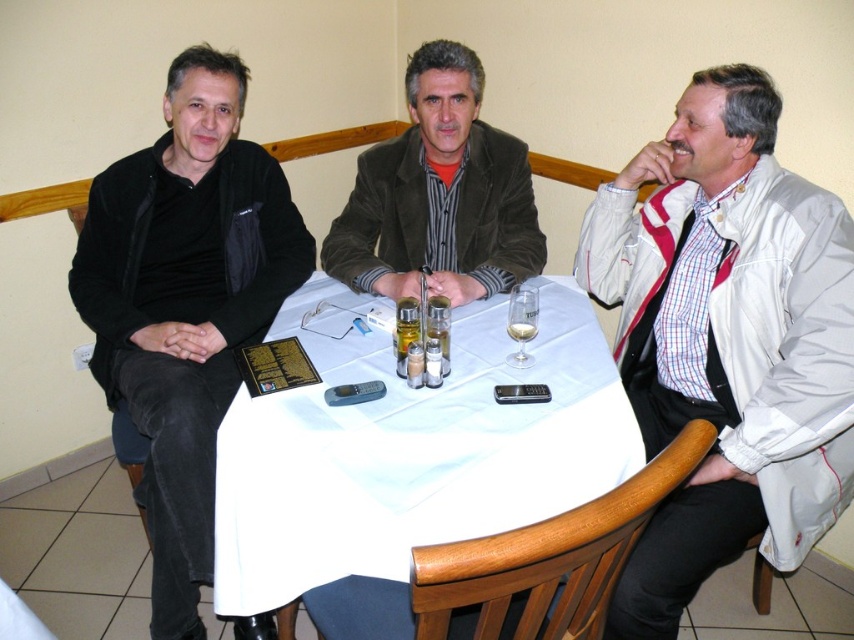
Is point (613, 221) in front of point (399, 161)?

Yes.

What do you see at coordinates (726, 340) in the screenshot? This screenshot has width=854, height=640. I see `white leather jacket at right` at bounding box center [726, 340].

Between point (658, 636) and point (334, 264), which one is positioned in front?

Positioned in front is point (658, 636).

Locate an element on the screen. Image resolution: width=854 pixels, height=640 pixels. white leather jacket at right is located at coordinates (726, 340).

Between white leather jacket at right and black matte jacket at left, which one has more height?

black matte jacket at left

Does white leather jacket at right appear under black matte jacket at left?

Correct, white leather jacket at right is located below black matte jacket at left.

Where is `white leather jacket at right`? white leather jacket at right is located at coordinates (726, 340).

This screenshot has width=854, height=640. Identify the location of white leather jacket at right. (726, 340).

Is white leather jacket at right bigger than white cloth at center?

Incorrect, white leather jacket at right is not larger than white cloth at center.

Is point (843, 371) positioned after point (477, 333)?

No, (843, 371) is closer to viewer.

Based on the photo, who is more forward, (829,525) or (490,403)?

Point (490,403) is more forward.

The image size is (854, 640). Find the location of `white leather jacket at right`. white leather jacket at right is located at coordinates (726, 340).